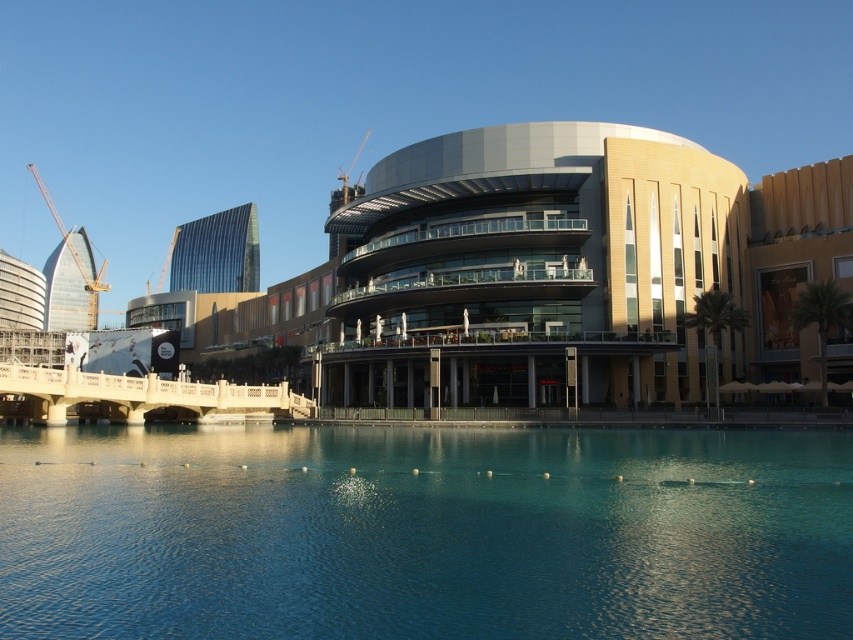
Question: Is clear blue water at center to the right of matte glass building at center from the viewer's perspective?

Choices:
 (A) yes
 (B) no

Answer: (A)

Question: Estimate the real-world distances between objects in this image. Which object is closer to the clear blue water at center?

Choices:
 (A) yellow construction crane at left
 (B) matte glass building at center

Answer: (B)

Question: From the image, what is the correct spatial relationship of matte glass building at center in relation to yellow construction crane at left?

Choices:
 (A) above
 (B) below

Answer: (B)

Question: Can you confirm if matte glass building at center is positioned below yellow construction crane at left?

Choices:
 (A) yes
 (B) no

Answer: (A)

Question: Which of the following is the farthest from the observer?

Choices:
 (A) clear blue water at center
 (B) matte glass building at center

Answer: (B)

Question: Which of the following is the farthest from the observer?

Choices:
 (A) pyautogui.click(x=659, y=445)
 (B) pyautogui.click(x=247, y=321)

Answer: (B)